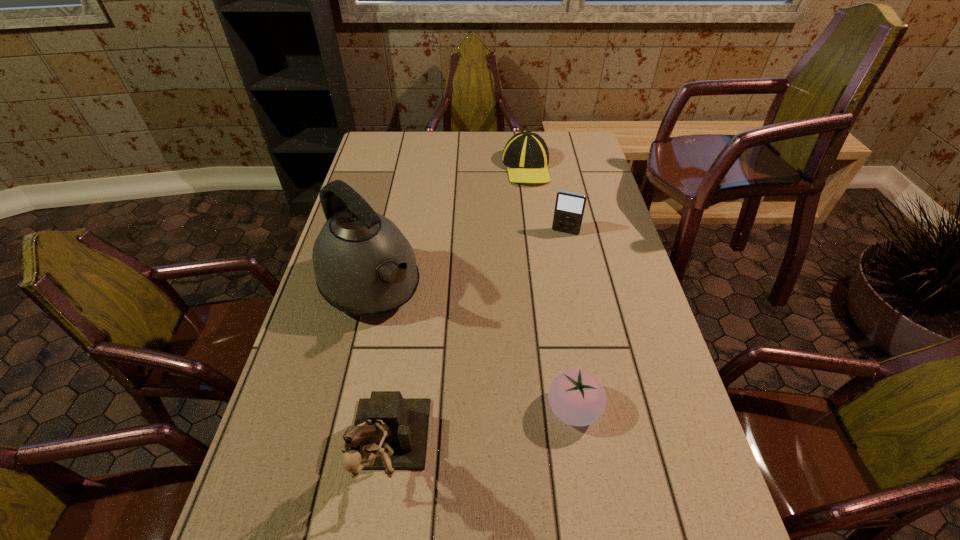
This screenshot has width=960, height=540. What are the coordinates of `vacant space at the far edge of the desktop` in the screenshot? It's located at (453, 146).

The width and height of the screenshot is (960, 540). Find the location of `free space at the left edge of the desktop`. free space at the left edge of the desktop is located at coordinates coord(389,185).

Locate an element on the screen. The width and height of the screenshot is (960, 540). vacant space at the right edge of the desktop is located at coordinates (591, 202).

Where is `vacant space at the near left corner of the desktop`? The height and width of the screenshot is (540, 960). vacant space at the near left corner of the desktop is located at coordinates (328, 505).

In the image, there is a desktop. Identify the location of free space at the near right corner. Image resolution: width=960 pixels, height=540 pixels. [x=697, y=491].

Locate an element on the screen. free space between the figurine and the third shortest object is located at coordinates (476, 344).

Where is `free space between the farthest object and the second farthest object`? free space between the farthest object and the second farthest object is located at coordinates (546, 200).

Image resolution: width=960 pixels, height=540 pixels. Find the location of `vacant space that is in between the tomato and the third nearest object`. vacant space that is in between the tomato and the third nearest object is located at coordinates (472, 348).

Image resolution: width=960 pixels, height=540 pixels. I want to click on empty space that is in between the tomato and the figurine, so click(x=480, y=432).

Locate an element on the screen. The image size is (960, 540). empty space between the kettle and the fourth nearest object is located at coordinates (468, 260).